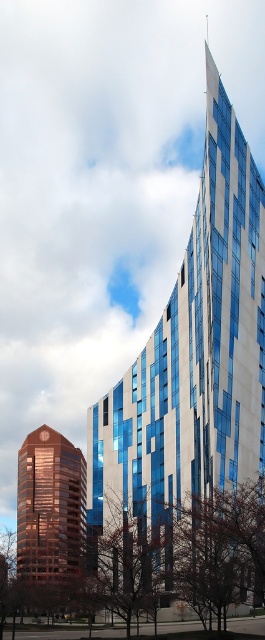
Does point (157, 387) come behind point (55, 481)?

No, (157, 387) is in front of (55, 481).

Does blue glass building at center come in front of shiny brown tower at lower left?

Yes, blue glass building at center is closer to the viewer.

This screenshot has width=265, height=640. Describe the element at coordinates (192, 353) in the screenshot. I see `blue glass building at center` at that location.

The height and width of the screenshot is (640, 265). What are the coordinates of `blue glass building at center` in the screenshot? It's located at (192, 353).